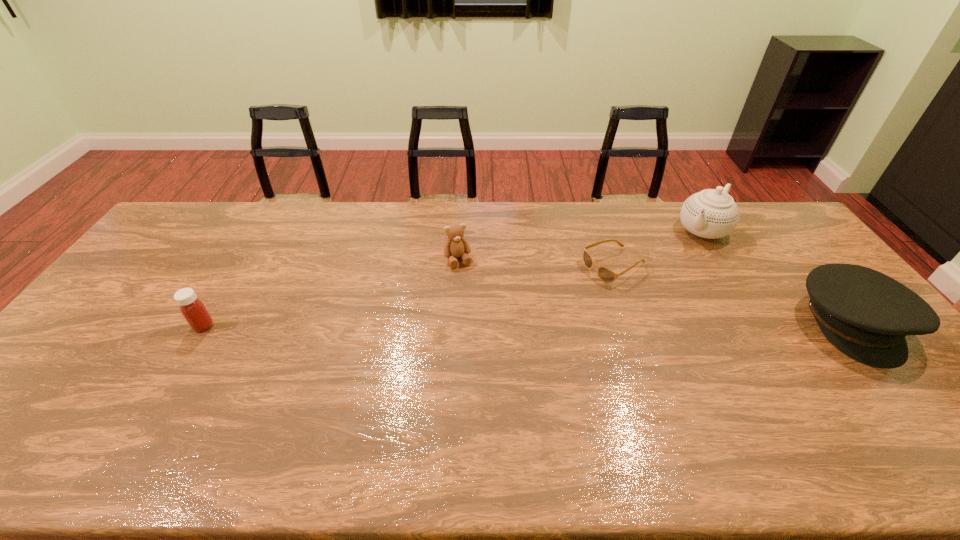
At what (x,y) coordinates should I click in order to perform the action: click on vacant area that lies between the chinaware and the leftmost object. Please return your answer as a coordinate pair (x, y). Looking at the image, I should click on (453, 278).

Image resolution: width=960 pixels, height=540 pixels. What are the coordinates of `vacant region between the tallest object and the rightmost object` in the screenshot? It's located at (777, 277).

Find the location of a particular element. The height and width of the screenshot is (540, 960). free area in between the beret and the sunglasses is located at coordinates (732, 295).

Identify the location of the closest object to the medicine. (456, 246).

You are a GUI agent. You are given a task and a screenshot of the screen. Output one action in this format:
    pyautogui.click(x=<x>, y=<y>)
    Task: Click on the object identified as the fourth closest to the fourth object from right to left
    
    Given the screenshot: What is the action you would take?
    tap(867, 315)

Where is `vacant region that satisfies the following two spatial constraints: 1. on the back side of the teddy bear; 2. on the left side of the medicine`? vacant region that satisfies the following two spatial constraints: 1. on the back side of the teddy bear; 2. on the left side of the medicine is located at coordinates (243, 260).

You are a GUI agent. You are given a task and a screenshot of the screen. Output one action in this format:
    pyautogui.click(x=<x>, y=<y>)
    Task: Click on the free space that satisfies the following two spatial constraints: 1. on the back side of the medicine; 2. on the right side of the second object from right to left
    This screenshot has width=960, height=540.
    Given the screenshot: What is the action you would take?
    pyautogui.click(x=261, y=231)